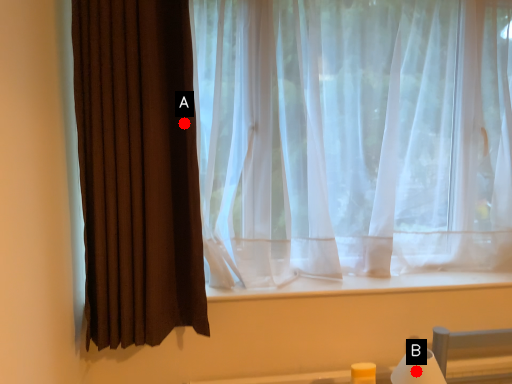
Question: Two points are circled on the image, labeled by A and B beside each circle. Which point is closer to the camera taking this photo?

Choices:
 (A) A is closer
 (B) B is closer

Answer: (A)